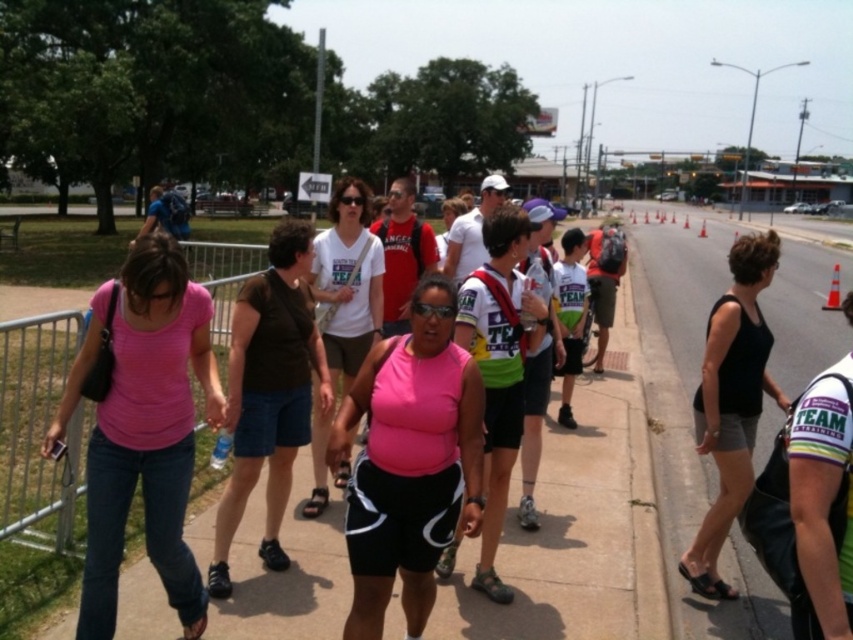
Based on the photo, who is taller, pink matte tank top at center or black tank top at right?

black tank top at right

Who is positioned more to the left, pink matte tank top at center or black tank top at right?

pink matte tank top at center

Image resolution: width=853 pixels, height=640 pixels. In order to click on pink matte tank top at center in this screenshot , I will do `click(409, 461)`.

Where is `pink matte tank top at center`? The height and width of the screenshot is (640, 853). pink matte tank top at center is located at coordinates (409, 461).

How much distance is there between pink matte shirt at center and black tank top at right?

The distance of pink matte shirt at center from black tank top at right is 2.76 meters.

Between pink matte shirt at center and black tank top at right, which one appears on the right side from the viewer's perspective?

black tank top at right

The height and width of the screenshot is (640, 853). Identify the location of pink matte shirt at center. (143, 428).

Who is taller, pink fabric at left or orange traffic cone at center-right?

With more height is orange traffic cone at center-right.

Does pink fabric at left appear on the right side of orange traffic cone at center-right?

In fact, pink fabric at left is to the left of orange traffic cone at center-right.

This screenshot has height=640, width=853. Describe the element at coordinates (578, 525) in the screenshot. I see `pink fabric at left` at that location.

The image size is (853, 640). What are the coordinates of `pink fabric at left` in the screenshot? It's located at (578, 525).